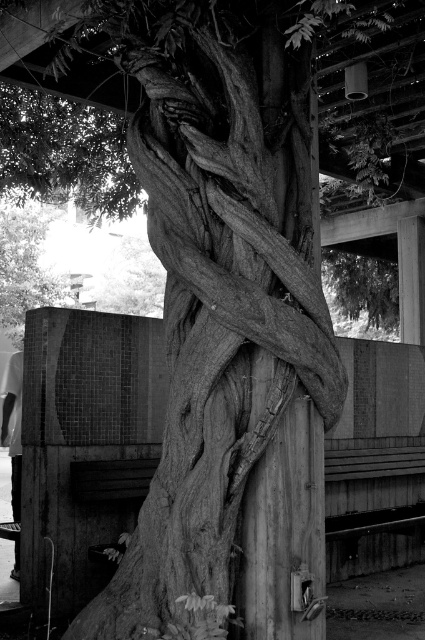
Question: From the image, what is the correct spatial relationship of wooden textured tree trunk at center in relation to wooden textured tree trunk at upper left?

Choices:
 (A) right
 (B) left

Answer: (A)

Question: Among these points, which one is farthest from the camera?

Choices:
 (A) (163, 28)
 (B) (42, 236)

Answer: (B)

Question: Among these points, which one is farthest from the camera?

Choices:
 (A) (11, 449)
 (B) (254, 438)

Answer: (A)

Question: Considering the real-world distances, which object is farthest from the wooden textured tree trunk at center?

Choices:
 (A) white fabric shirt at lower left
 (B) wooden textured tree trunk at upper left

Answer: (B)

Question: Where is wooden textured tree trunk at upper left located in relation to white fabric shirt at lower left in the image?

Choices:
 (A) left
 (B) right

Answer: (A)

Question: Can you confirm if wooden textured tree trunk at center is smaller than wooden textured tree trunk at upper left?

Choices:
 (A) yes
 (B) no

Answer: (A)